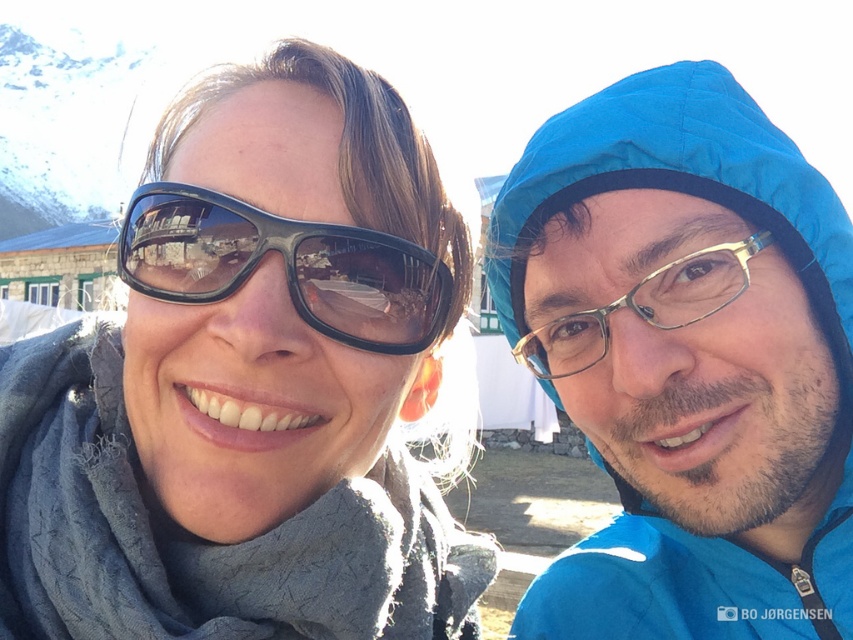
Question: Which is farther from the gold-framed glasses at right?

Choices:
 (A) matte black sunglasses at upper left
 (B) black matte goggles at left

Answer: (A)

Question: Does matte black sunglasses at upper left have a lesser width compared to gold-framed glasses at right?

Choices:
 (A) no
 (B) yes

Answer: (A)

Question: Which object appears closest to the camera in this image?

Choices:
 (A) gold-framed glasses at right
 (B) blue quilted raincoat at upper right
 (C) black matte goggles at left
 (D) matte black sunglasses at upper left

Answer: (D)

Question: Among these points, which one is nearest to the camera?

Choices:
 (A) (764, 141)
 (B) (227, 388)
 (C) (338, 266)

Answer: (B)

Question: Does black matte goggles at left have a lesser width compared to gold-framed glasses at right?

Choices:
 (A) no
 (B) yes

Answer: (A)

Question: Does black matte goggles at left appear on the left side of gold-framed glasses at right?

Choices:
 (A) yes
 (B) no

Answer: (A)